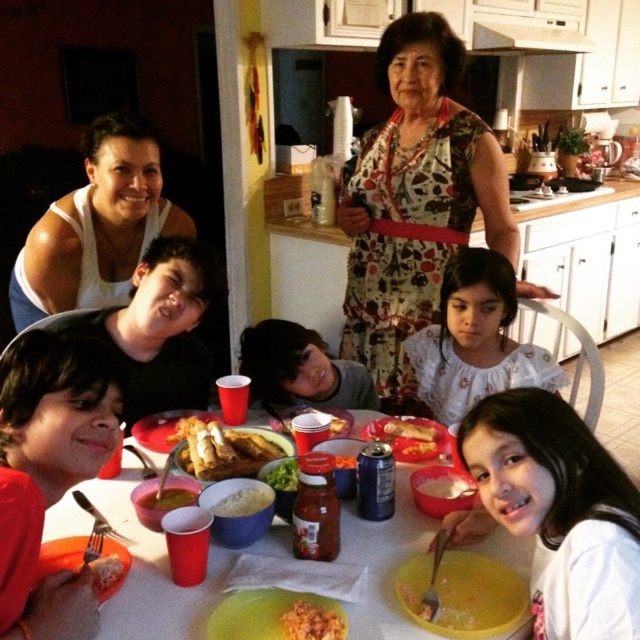
Question: Is white tank top at upper left thinner than slightly yellowish matte salsa at table center?

Choices:
 (A) no
 (B) yes

Answer: (A)

Question: Which point is farther to the camera?

Choices:
 (A) smooth yellow rice at lower left
 (B) white creamy rice at center
 (C) white matte bowl at center
 (D) floral apron at center

Answer: (D)

Question: Is slightly yellowish matte salsa at table center closer to the viewer compared to smooth yellow rice at lower left?

Choices:
 (A) yes
 (B) no

Answer: (B)

Question: Which point is farther to the camera?

Choices:
 (A) (396, 426)
 (B) (102, 202)

Answer: (B)

Question: In this image, where is plastic red cup at lower left located relative to white tank top at upper left?

Choices:
 (A) right
 (B) left

Answer: (A)

Question: Which object is closer to the camera taking this photo?

Choices:
 (A) white floral dress at center
 (B) smooth yellow rice at lower left

Answer: (B)